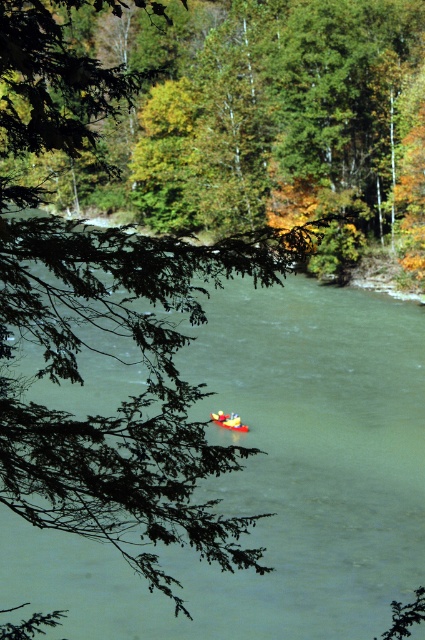
You are standing at the origin point of the image. Where is the yellow plastic kayak at center located in relation to your position?

The yellow plastic kayak at center is located at coordinates point (130, 394) relative to the origin point of the image.

You are a kayaker who wants to cross the river. You see a yellow plastic kayak at center and a bright yellow plastic boat at center. Can you use either of them to cross the river?

Both the yellow plastic kayak at center and the bright yellow plastic boat at center are available for use. Since they are both boats, you can choose either to cross the river.